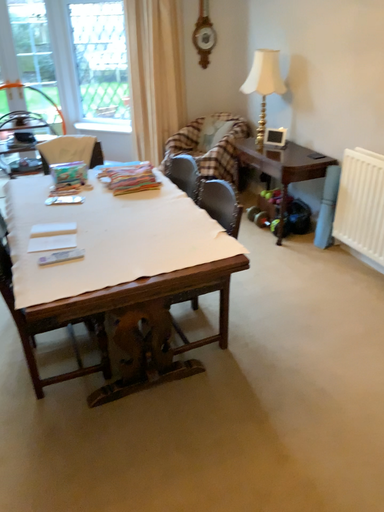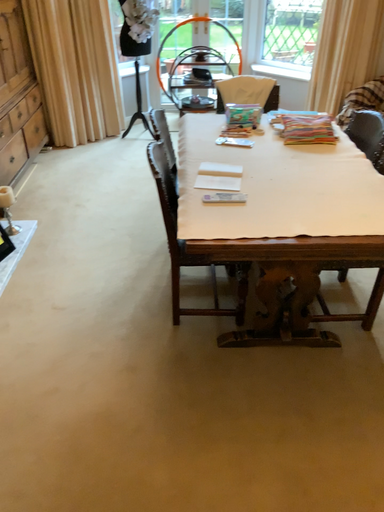
Question: Which way did the camera rotate in the video?

Choices:
 (A) rotated left
 (B) rotated right

Answer: (A)